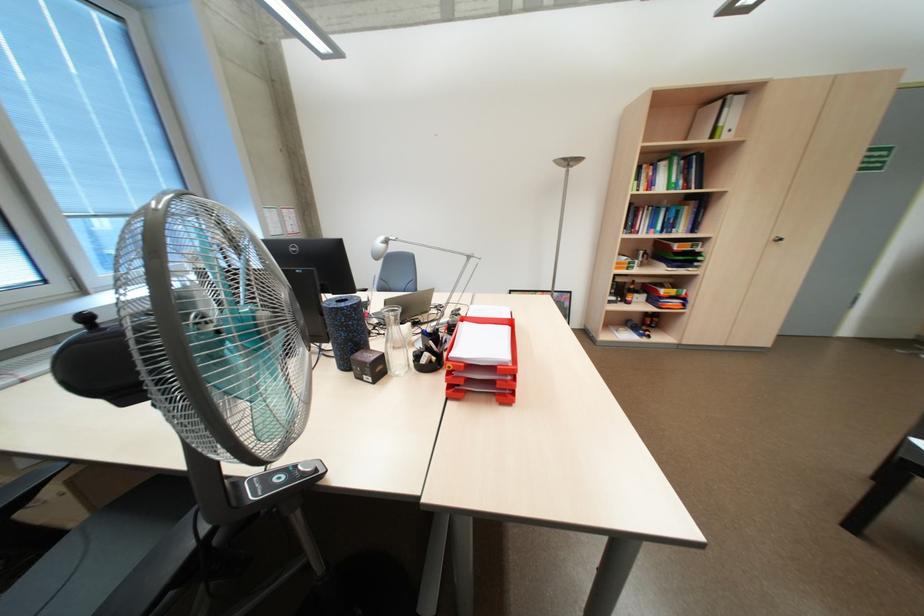
At what (x,y) coordinates should I click in order to perform the action: click on fan control button. Please return your answer as a coordinate pair (x, y). The height and width of the screenshot is (616, 924). Looking at the image, I should click on (278, 477).